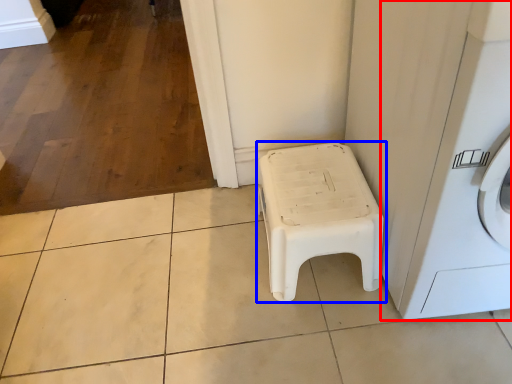
Question: Among these objects, which one is nearest to the camera, washing machine (highlighted by a red box) or furniture (highlighted by a blue box)?

Choices:
 (A) washing machine
 (B) furniture

Answer: (A)